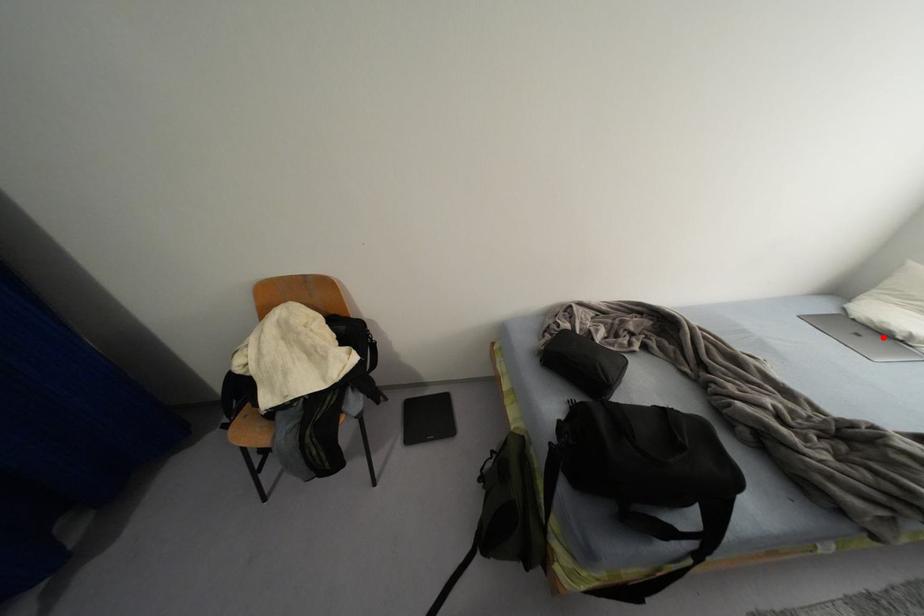
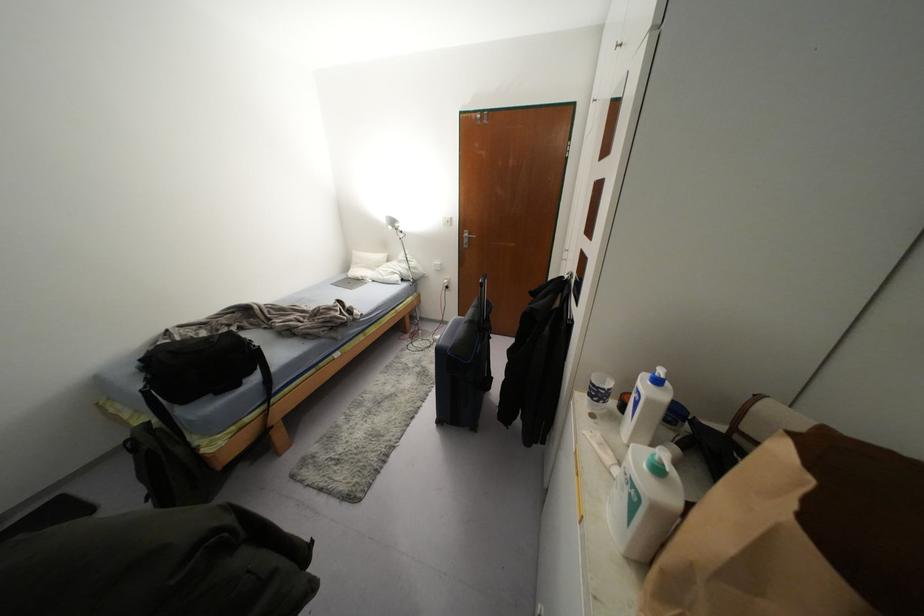
Question: I am providing you with two images of the same scene from different viewpoints. A red point is marked on the first image. Can you still see the location of the red point in image 2?

Choices:
 (A) Yes
 (B) No

Answer: (A)